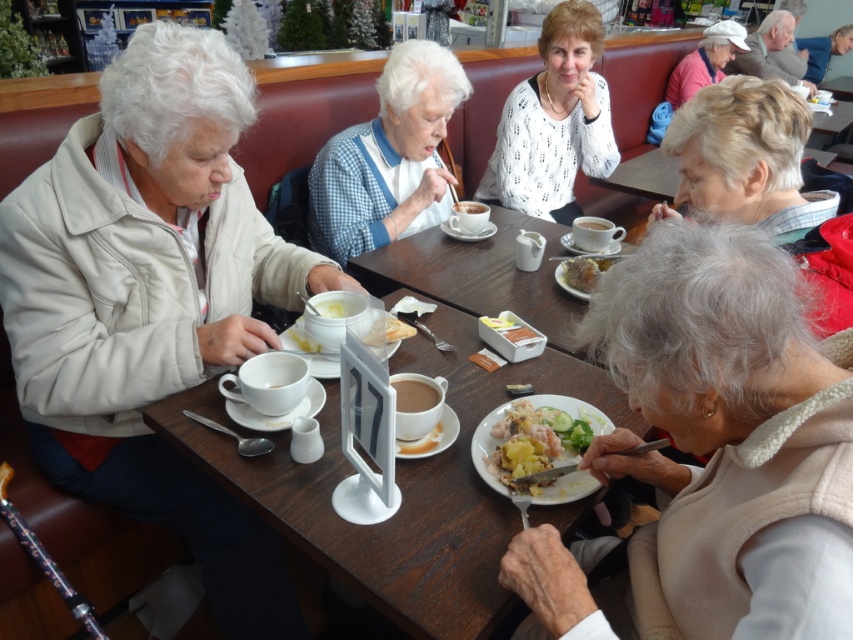
From the picture: You are a waiter in a restaurant and need to deliver a dessert to the table. The dessert needs to be placed on the matte ceramic cup at center. However, there is a pink fabric hat at upper right nearby. Can you safely place the dessert on the cup without the hat obstructing the space?

The distance between the pink fabric hat at upper right and the matte ceramic cup at center is 3.63 meters. Since the hat is far enough away, you can safely place the dessert on the cup without any obstruction.

You are a photographer standing at the camera position. You want to take a closeup photo of the pink fabric hat at upper right. Can you reach it with your hand to adjust it before taking the photo?

The pink fabric hat at upper right is 3.74 meters from camera, so you cannot reach it with your hand to adjust it before taking the photo.

You are a delivery person who needs to leave a package at the table where the white matte jacket at left and the white dotted sweater at center are located. The package is 1.5 meters long. Can you place the package horizontally between the two items without overlapping them?

The distance between the white matte jacket at left and the white dotted sweater at center is 1.40 meters. Since the package is 1.5 meters long, it cannot be placed horizontally between them without overlapping the items.